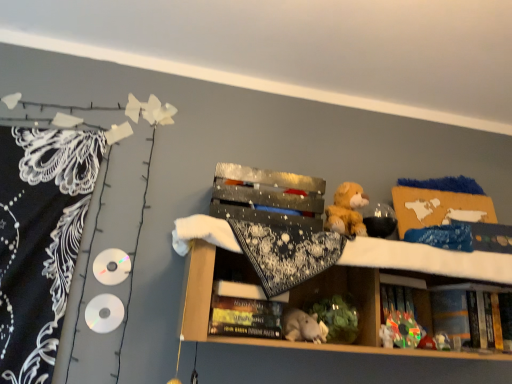
Question: Is black lace blanket at left with plush toy at center, which is the first toy from right to left?

Choices:
 (A) yes
 (B) no

Answer: (B)

Question: Is black lace blanket at left aimed at plush toy at center, which is counted as the 3th toy, starting from the left?

Choices:
 (A) yes
 (B) no

Answer: (B)

Question: Would you say plush toy at center, which is the first toy from right to left, is part of black lace blanket at left's contents?

Choices:
 (A) no
 (B) yes

Answer: (A)

Question: Considering the relative positions of black lace blanket at left and plush toy at center, acting as the 2th toy starting from the bottom, in the image provided, is black lace blanket at left to the left of plush toy at center, acting as the 2th toy starting from the bottom, from the viewer's perspective?

Choices:
 (A) yes
 (B) no

Answer: (A)

Question: Is black lace blanket at left bigger than plush toy at center, acting as the 2th toy starting from the bottom?

Choices:
 (A) no
 (B) yes

Answer: (B)

Question: Looking at their shapes, would you say hardcover book at lower right, acting as the 2th book starting from the left, is wider or thinner than plush toy at center, which is counted as the 3th toy, starting from the left?

Choices:
 (A) wide
 (B) thin

Answer: (A)

Question: In terms of height, does hardcover book at lower right, acting as the second book starting from the front, look taller or shorter compared to plush toy at center, which is the first toy from right to left?

Choices:
 (A) short
 (B) tall

Answer: (B)

Question: Is hardcover book at lower right, which ranks as the 1th book in right-to-left order, in front of or behind plush toy at center, acting as the 2th toy starting from the bottom, in the image?

Choices:
 (A) behind
 (B) front

Answer: (A)

Question: In terms of size, does hardcover book at lower right, which is the first book in back-to-front order, appear bigger or smaller than plush toy at center, which is the first toy from right to left?

Choices:
 (A) small
 (B) big

Answer: (B)

Question: From a real-world perspective, is gray plush toy at center above or below black lace blanket at left?

Choices:
 (A) below
 (B) above

Answer: (A)

Question: Is gray plush toy at center inside or outside of black lace blanket at left?

Choices:
 (A) outside
 (B) inside

Answer: (A)

Question: From their relative heights in the image, would you say gray plush toy at center is taller or shorter than black lace blanket at left?

Choices:
 (A) tall
 (B) short

Answer: (B)

Question: Considering the positions of point click(x=308, y=319) and point click(x=55, y=233), is point click(x=308, y=319) closer or farther from the camera than point click(x=55, y=233)?

Choices:
 (A) farther
 (B) closer

Answer: (B)

Question: In the image, is shiny metallic box at center positioned in front of or behind plush toy at center, which is the first toy from right to left?

Choices:
 (A) behind
 (B) front

Answer: (B)

Question: Considering the positions of shiny metallic box at center and plush toy at center, which is counted as the 3th toy, starting from the left, in the image, is shiny metallic box at center wider or thinner than plush toy at center, which is counted as the 3th toy, starting from the left,?

Choices:
 (A) wide
 (B) thin

Answer: (A)